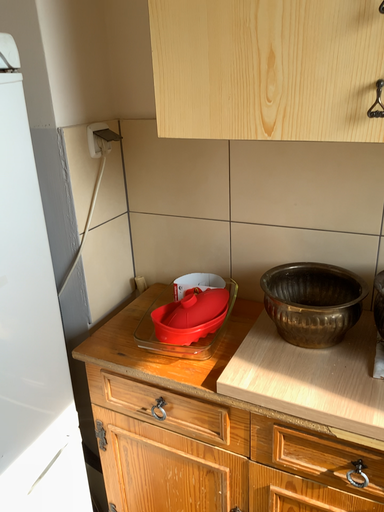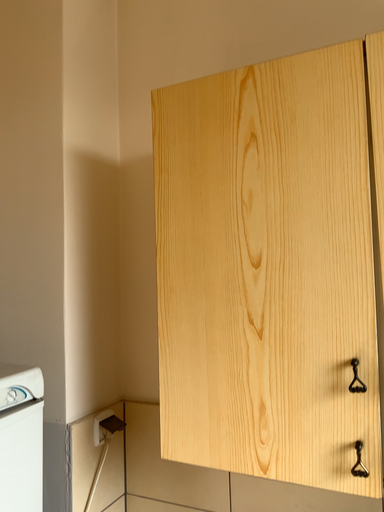
Question: Which way did the camera rotate in the video?

Choices:
 (A) rotated downward
 (B) rotated upward

Answer: (B)